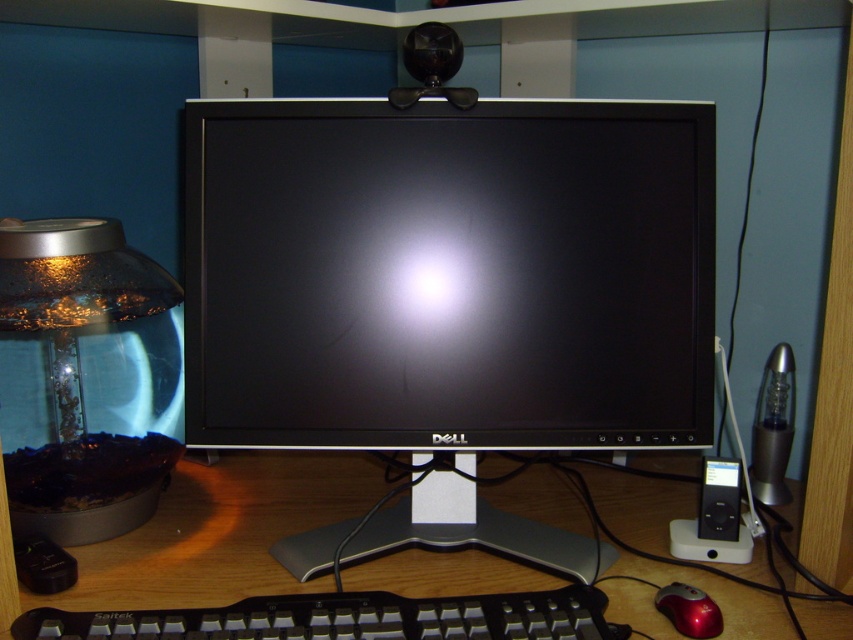
Is black glossy monitor at center to the left of wooden at center from the viewer's perspective?

No, black glossy monitor at center is not to the left of wooden at center.

Does black glossy monitor at center appear on the right side of wooden at center?

Indeed, black glossy monitor at center is positioned on the right side of wooden at center.

Is point (349, 259) behind point (665, 531)?

No, it is in front of (665, 531).

The height and width of the screenshot is (640, 853). What are the coordinates of `black glossy monitor at center` in the screenshot? It's located at (448, 275).

Who is more forward, (445, 236) or (693, 636)?

Point (693, 636) is in front.

Is point (337, 104) behind point (694, 627)?

That is True.

At what (x,y) coordinates should I click in order to perform the action: click on black glossy monitor at center. Please return your answer as a coordinate pair (x, y). The height and width of the screenshot is (640, 853). Looking at the image, I should click on (448, 275).

Measure the distance between point (204,566) and camera.

They are 83.37 centimeters apart.

Does wooden at center appear on the left side of shiny red mouse at lower right?

Yes, wooden at center is to the left of shiny red mouse at lower right.

The height and width of the screenshot is (640, 853). What do you see at coordinates (264, 544) in the screenshot?
I see `wooden at center` at bounding box center [264, 544].

Locate an element on the screen. This screenshot has width=853, height=640. wooden at center is located at coordinates (264, 544).